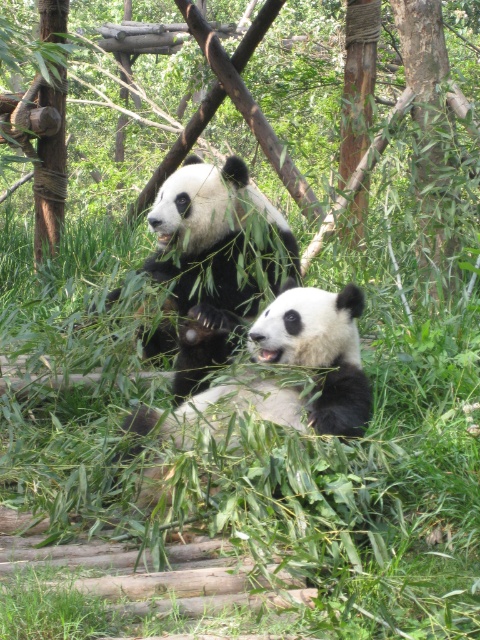
Question: Which is nearer to the black fuzzy panda at center?

Choices:
 (A) green leafy tree at upper center
 (B) black fuzzy panda at upper center

Answer: (B)

Question: Which object is positioned closest to the black fuzzy panda at upper center?

Choices:
 (A) black fuzzy panda at center
 (B) green leafy tree at upper center

Answer: (A)

Question: Does green leafy tree at upper center appear under black fuzzy panda at upper center?

Choices:
 (A) no
 (B) yes

Answer: (A)

Question: Which point appears closest to the camera in this image?

Choices:
 (A) pos(299,353)
 (B) pos(228,72)
 (C) pos(244,216)

Answer: (A)

Question: Is green leafy tree at upper center further to the viewer compared to black fuzzy panda at upper center?

Choices:
 (A) no
 (B) yes

Answer: (B)

Question: From the image, what is the correct spatial relationship of green leafy tree at upper center in relation to black fuzzy panda at center?

Choices:
 (A) right
 (B) left

Answer: (B)